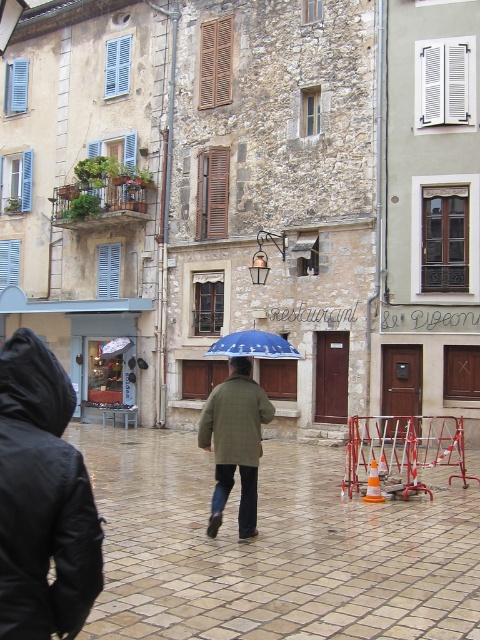
You are a tourist standing on the brown stone pavement at center and want to take a photo of the green matte coat at center. Which direction should you move to get the best shot?

The brown stone pavement at center is to the right of the green matte coat at center, so you should move to the left to position yourself in front of the green matte coat at center for a better photo.

You are standing on the brown stone pavement at center and want to reach the blue fabric umbrella at center. In which direction should you move?

The brown stone pavement at center is to the right of the blue fabric umbrella at center, so you should move to the left to reach it.